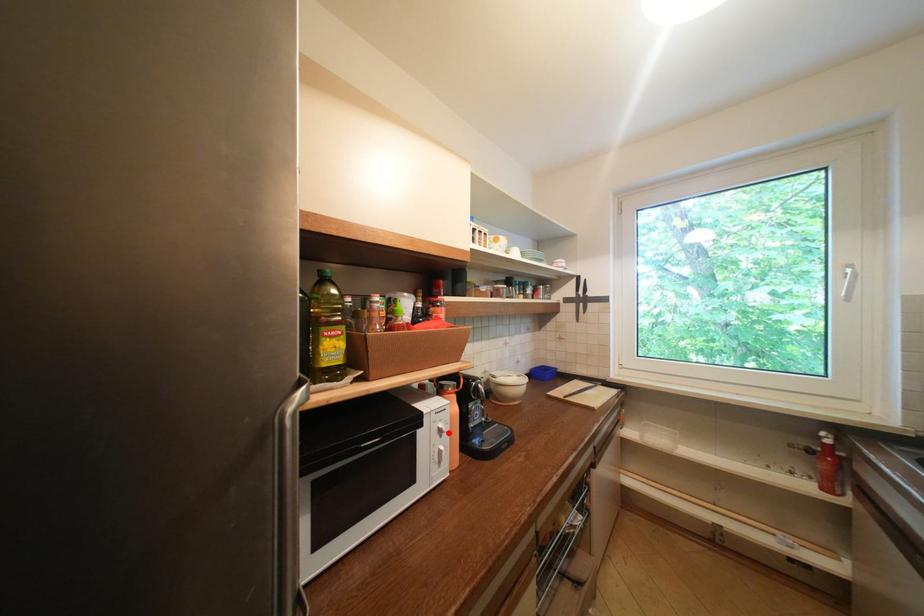
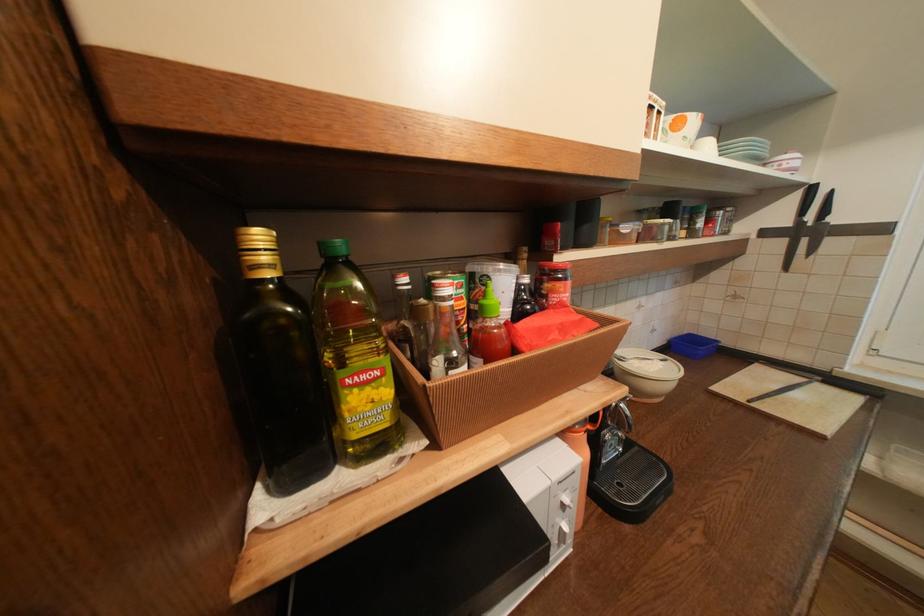
In the second image, find the point that corresponds to the highlighted location in the first image.

(573, 507)